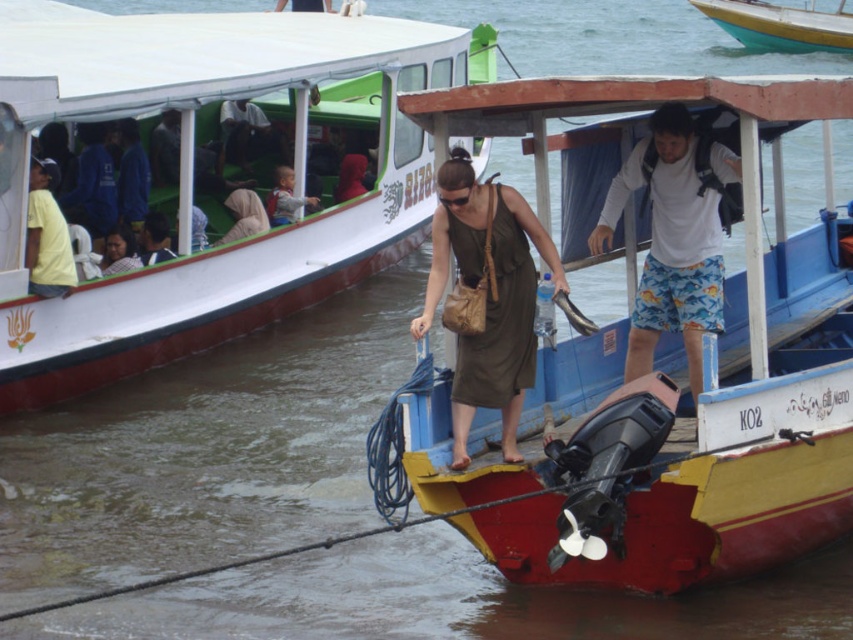
Question: Which point is farther to the camera?

Choices:
 (A) olive green fabric dress at center
 (B) teal glossy boat at upper center
 (C) white cotton t-shirt at upper right
 (D) red painted wood boat at center

Answer: (B)

Question: Can you confirm if red painted wood boat at center is wider than yellow matte shirt at left?

Choices:
 (A) no
 (B) yes

Answer: (B)

Question: Which point is closer to the camera?

Choices:
 (A) light brown backpack at upper left
 (B) light brown fabric headscarf at upper left

Answer: (B)

Question: Is dark blue shirt at left to the right of dark brown leather jacket at upper center from the viewer's perspective?

Choices:
 (A) yes
 (B) no

Answer: (B)

Question: Is matte beige hijab at upper left wider than dark brown leather jacket at upper center?

Choices:
 (A) no
 (B) yes

Answer: (A)

Question: Which object is closer to the camera taking this photo?

Choices:
 (A) light brown fabric headscarf at upper left
 (B) wooden boat at center
 (C) dark blue shirt at left

Answer: (B)